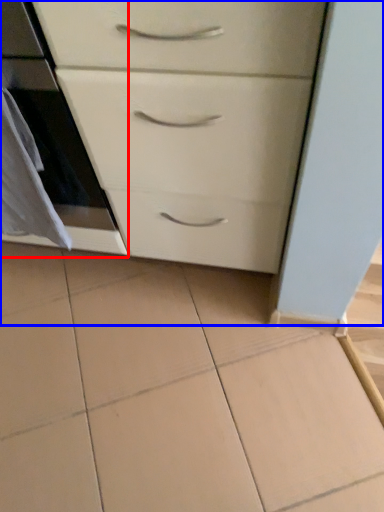
Question: Which object appears farthest to the camera in this image, oven (highlighted by a red box) or chest of drawers (highlighted by a blue box)?

Choices:
 (A) oven
 (B) chest of drawers

Answer: (A)